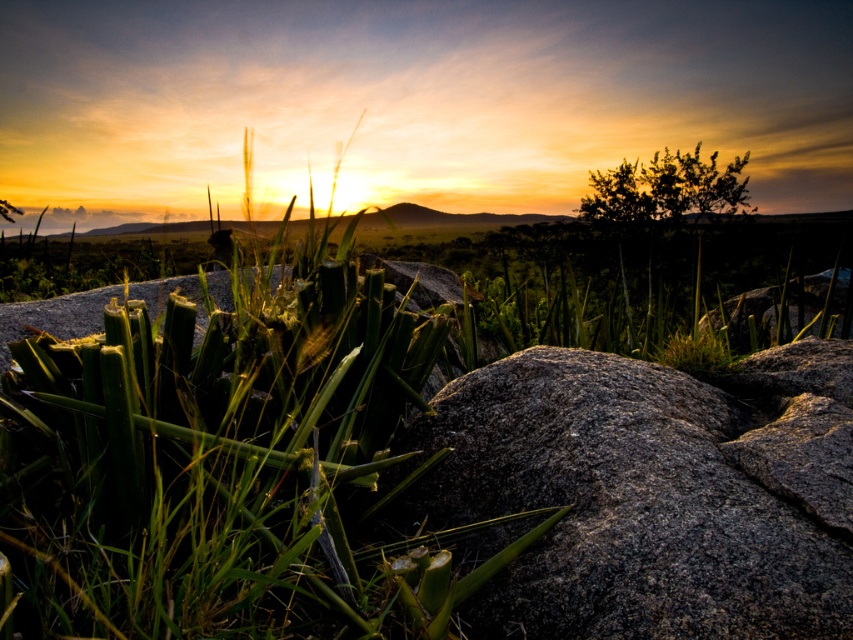
Does point (219, 355) lie behind point (675, 410)?

No, (219, 355) is in front of (675, 410).

Is point (209, 566) farther from viewer compared to point (782, 625)?

No, it is not.

Identify the location of green rough grass at center. (218, 458).